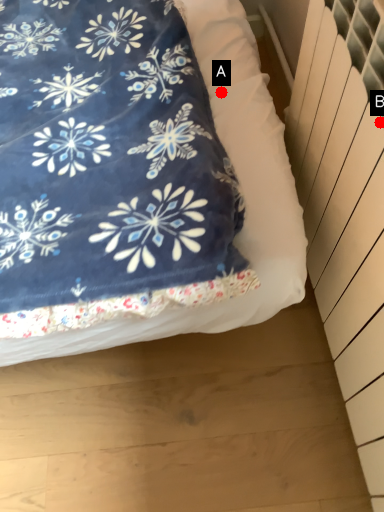
Question: Two points are circled on the image, labeled by A and B beside each circle. Which point is further to the camera?

Choices:
 (A) A is further
 (B) B is further

Answer: (A)